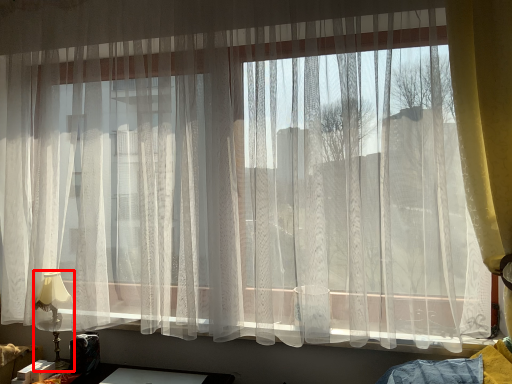
Question: Considering the relative positions of table lamp (annotated by the red box) and curtain in the image provided, where is table lamp (annotated by the red box) located with respect to the staircase?

Choices:
 (A) left
 (B) right

Answer: (A)